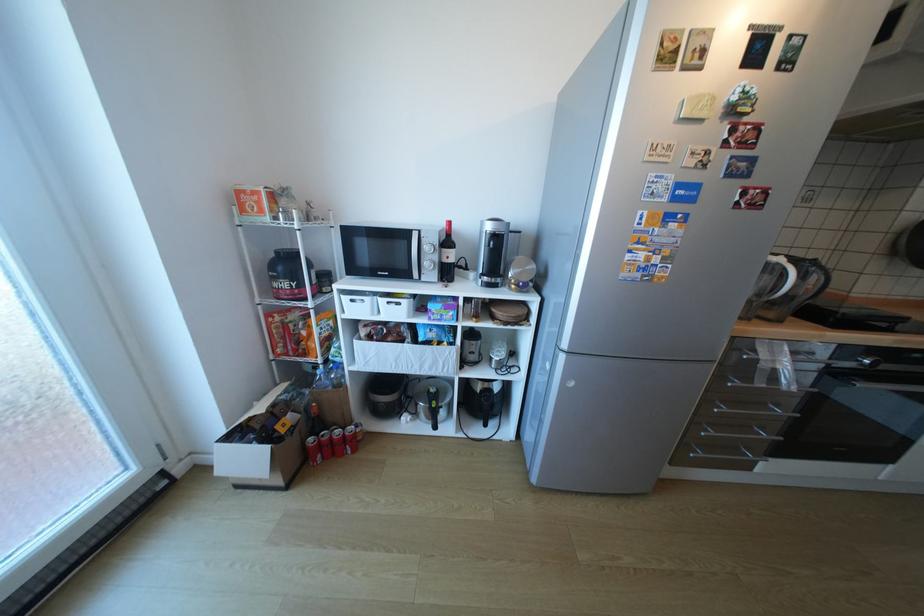
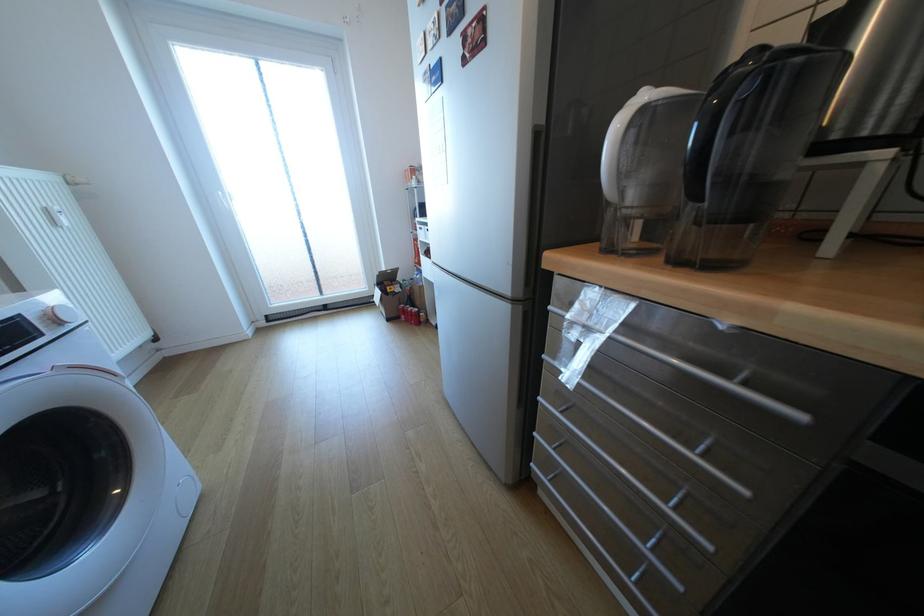
Where in the second image is the point corresponding to point 286,427 from the first image?

(397, 288)